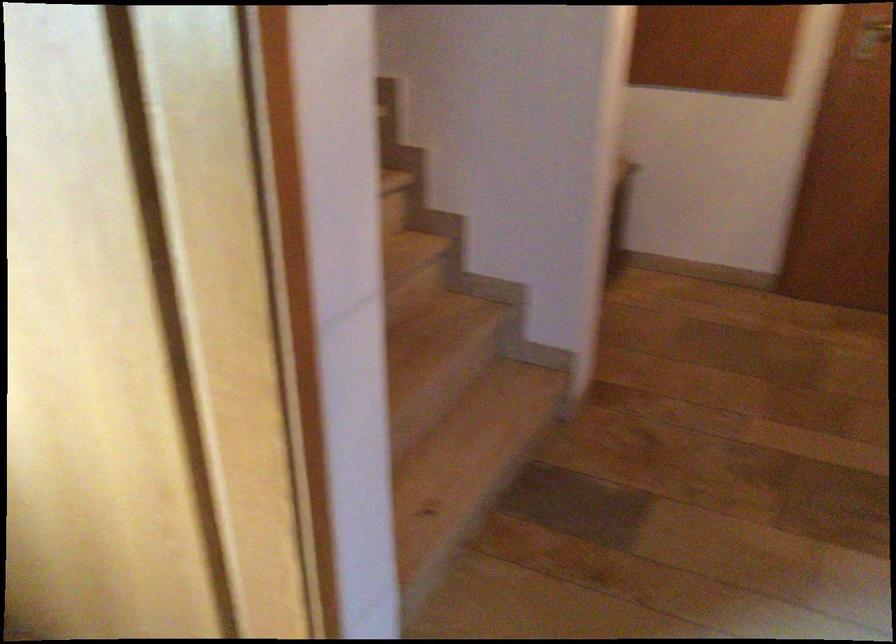
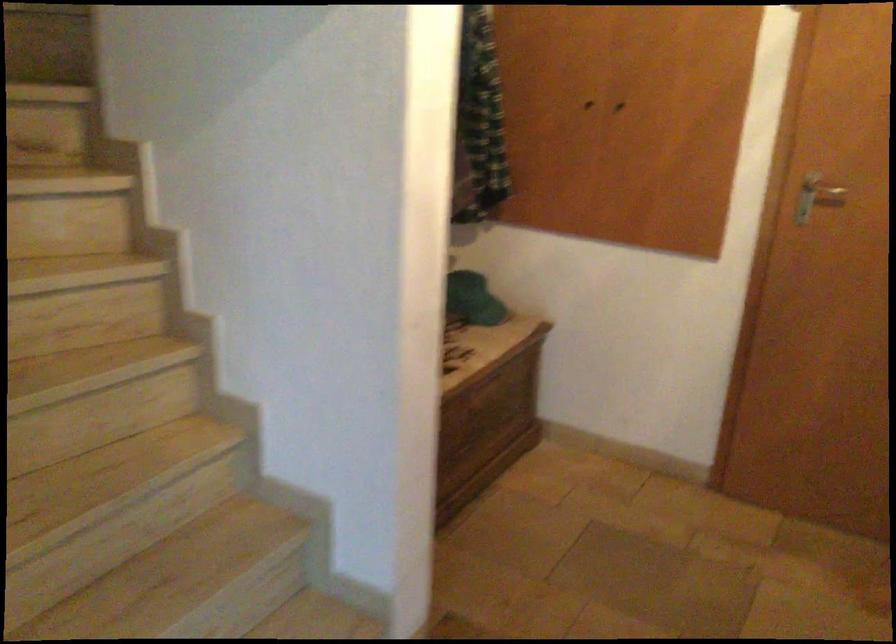
Question: How did the camera likely rotate?

Choices:
 (A) Left
 (B) Right
 (C) Up
 (D) Down

Answer: (C)